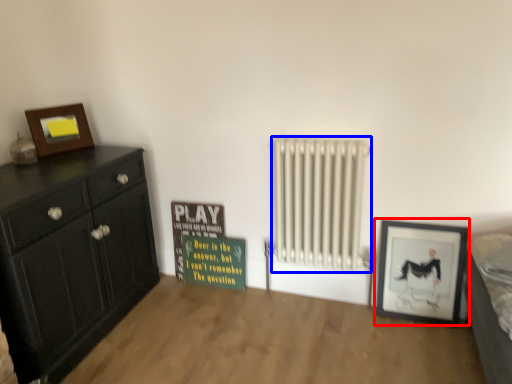
Question: Which of the following is the farthest to the observer, picture frame (highlighted by a red box) or radiator (highlighted by a blue box)?

Choices:
 (A) picture frame
 (B) radiator

Answer: (A)